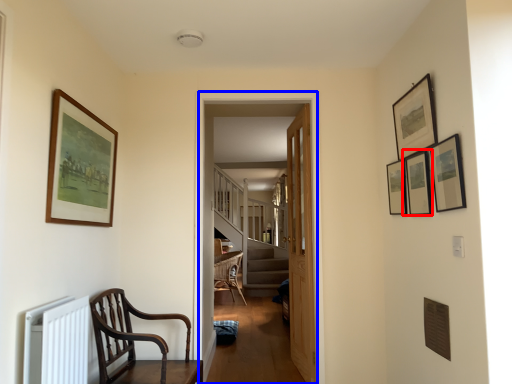
Question: Among these objects, which one is nearest to the camera, picture frame (highlighted by a red box) or corridor (highlighted by a blue box)?

Choices:
 (A) picture frame
 (B) corridor

Answer: (A)